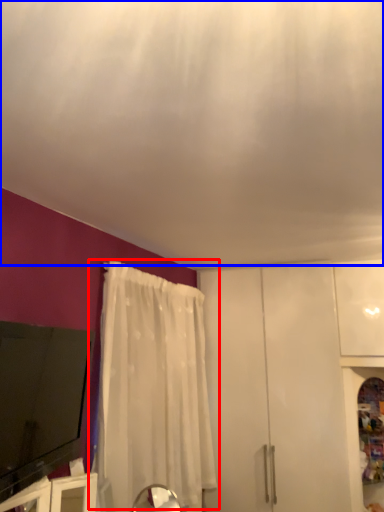
Question: Among these objects, which one is nearest to the camera, curtain (highlighted by a red box) or blind (highlighted by a blue box)?

Choices:
 (A) curtain
 (B) blind

Answer: (B)